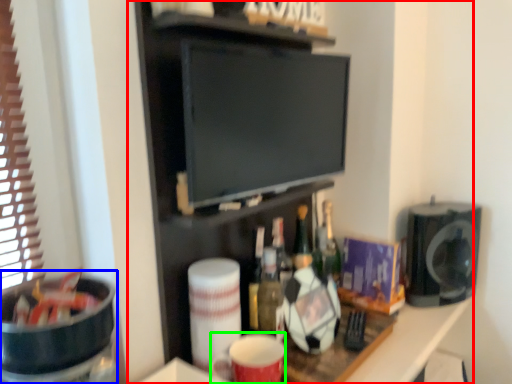
Question: Considering the real-world distances, which object is closest to entertainment center (highlighted by a red box)? appliance (highlighted by a blue box) or mug (highlighted by a green box).

Choices:
 (A) appliance
 (B) mug

Answer: (B)